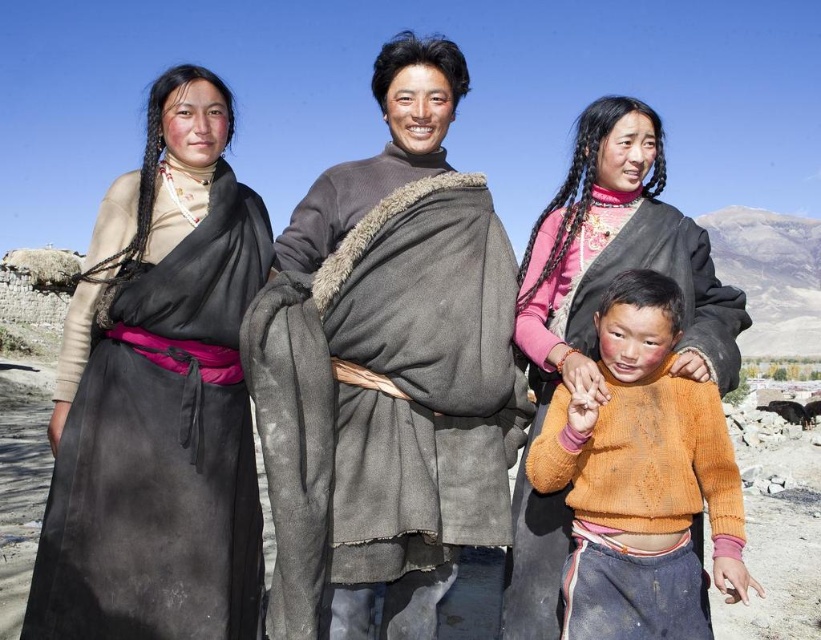
Question: Does gray woolen robe at center have a larger size compared to matte black robe at left?

Choices:
 (A) yes
 (B) no

Answer: (B)

Question: Estimate the real-world distances between objects in this image. Which object is farther from the gray woolen robe at center?

Choices:
 (A) orange knitted sweater at center
 (B) matte black robe at left

Answer: (A)

Question: Does gray woolen robe at center have a larger size compared to orange knitted sweater at center?

Choices:
 (A) yes
 (B) no

Answer: (A)

Question: Estimate the real-world distances between objects in this image. Which object is farther from the orange knitted sweater at center?

Choices:
 (A) gray woolen robe at center
 (B) matte black robe at left

Answer: (B)

Question: Can you confirm if matte black robe at left is positioned above orange knitted sweater at center?

Choices:
 (A) yes
 (B) no

Answer: (A)

Question: Among these points, which one is farthest from the camera?

Choices:
 (A) (429, 609)
 (B) (645, 304)

Answer: (A)